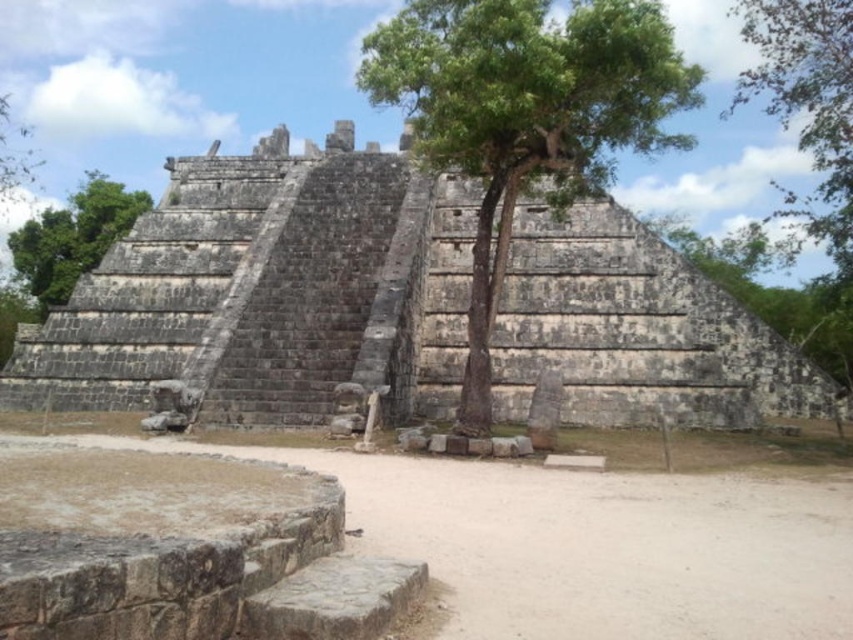
Can you confirm if green leafy tree at left is smaller than green leafy tree at upper left?

Incorrect, green leafy tree at left is not smaller in size than green leafy tree at upper left.

In the scene shown: Which of these two, green leafy tree at left or green leafy tree at upper left, stands taller?

green leafy tree at left

Find the location of a particular element. The image size is (853, 640). green leafy tree at left is located at coordinates (71, 237).

In the scene shown: Which is below, gray stone ruins at center or green leafy tree at upper left?

gray stone ruins at center is below.

Does gray stone ruins at center appear under green leafy tree at upper left?

Yes.

Which is behind, point (279, 195) or point (25, 179)?

The point (25, 179) is more distant.

Locate an element on the screen. gray stone ruins at center is located at coordinates (268, 292).

In the scene shown: How much distance is there between gray stone ruins at center and green leafy tree at upper right?

66.00 meters

This screenshot has width=853, height=640. Describe the element at coordinates (268, 292) in the screenshot. I see `gray stone ruins at center` at that location.

Where is `gray stone ruins at center`? Image resolution: width=853 pixels, height=640 pixels. gray stone ruins at center is located at coordinates tap(268, 292).